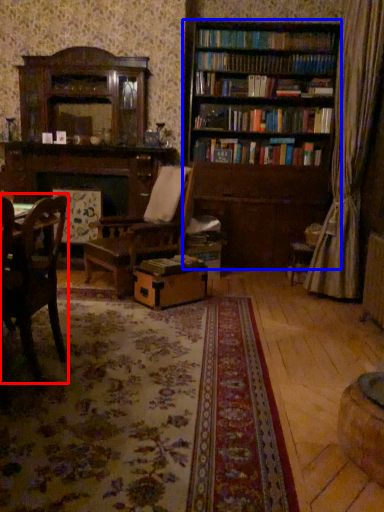
Question: Which point is further to the camera, chair (highlighted by a red box) or bookcase (highlighted by a blue box)?

Choices:
 (A) chair
 (B) bookcase

Answer: (B)